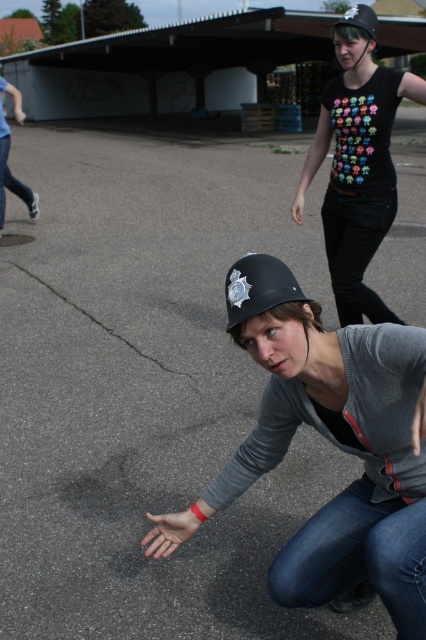
Does point (304, 394) lie in front of point (353, 12)?

Yes, it is in front of point (353, 12).

Between point (368, 342) and point (368, 35), which one is positioned in front?

Point (368, 342) is more forward.

The width and height of the screenshot is (426, 640). I want to click on matte black helmet at center, so click(x=331, y=442).

Does black matte helmet at center appear under black matte helmet at upper center?

Yes.

Is black matte helmet at center thinner than black matte helmet at upper center?

Correct, black matte helmet at center's width is less than black matte helmet at upper center's.

Which is in front, point (232, 328) or point (368, 6)?

Point (232, 328) is more forward.

At what (x,y) coordinates should I click in order to perform the action: click on black matte helmet at center. Please return your answer as a coordinate pair (x, y). Looking at the image, I should click on (258, 288).

The height and width of the screenshot is (640, 426). Describe the element at coordinates (356, 163) in the screenshot. I see `black matte t-shirt at upper right` at that location.

Can you confirm if black matte t-shirt at upper right is positioned above black matte helmet at upper center?

No, black matte t-shirt at upper right is not above black matte helmet at upper center.

Is point (388, 209) closer to camera compared to point (368, 10)?

No, it is not.

This screenshot has width=426, height=640. In order to click on black matte t-shirt at upper right in this screenshot , I will do `click(356, 163)`.